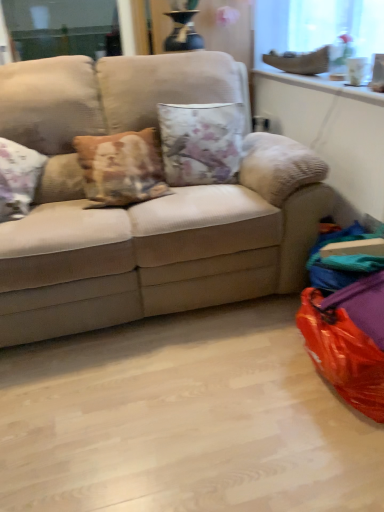
Question: Is the depth of beige fabric couch at center greater than that of translucent glass window screen at upper right?

Choices:
 (A) no
 (B) yes

Answer: (A)

Question: Is translucent glass window screen at upper right a part of beige fabric couch at center?

Choices:
 (A) yes
 (B) no

Answer: (B)

Question: Is beige fabric couch at center not near translucent glass window screen at upper right?

Choices:
 (A) no
 (B) yes

Answer: (B)

Question: Is beige fabric couch at center looking in the opposite direction of translucent glass window screen at upper right?

Choices:
 (A) yes
 (B) no

Answer: (B)

Question: Does beige fabric couch at center appear on the right side of translucent glass window screen at upper right?

Choices:
 (A) no
 (B) yes

Answer: (A)

Question: Does beige fabric couch at center have a lesser height compared to translucent glass window screen at upper right?

Choices:
 (A) yes
 (B) no

Answer: (B)

Question: From a real-world perspective, is beige fabric couch at center located beneath orange plastic bean bag chair at lower right?

Choices:
 (A) no
 (B) yes

Answer: (A)

Question: From the image's perspective, is beige fabric couch at center located beneath orange plastic bean bag chair at lower right?

Choices:
 (A) no
 (B) yes

Answer: (A)

Question: Is beige fabric couch at center far away from orange plastic bean bag chair at lower right?

Choices:
 (A) yes
 (B) no

Answer: (B)

Question: Can you confirm if beige fabric couch at center is positioned to the left of orange plastic bean bag chair at lower right?

Choices:
 (A) no
 (B) yes

Answer: (B)

Question: Is beige fabric couch at center closer to the viewer compared to orange plastic bean bag chair at lower right?

Choices:
 (A) yes
 (B) no

Answer: (B)

Question: Does beige fabric couch at center have a smaller size compared to orange plastic bean bag chair at lower right?

Choices:
 (A) no
 (B) yes

Answer: (A)

Question: Is floral fabric cushion at center far away from beige fabric couch at center?

Choices:
 (A) yes
 (B) no

Answer: (B)